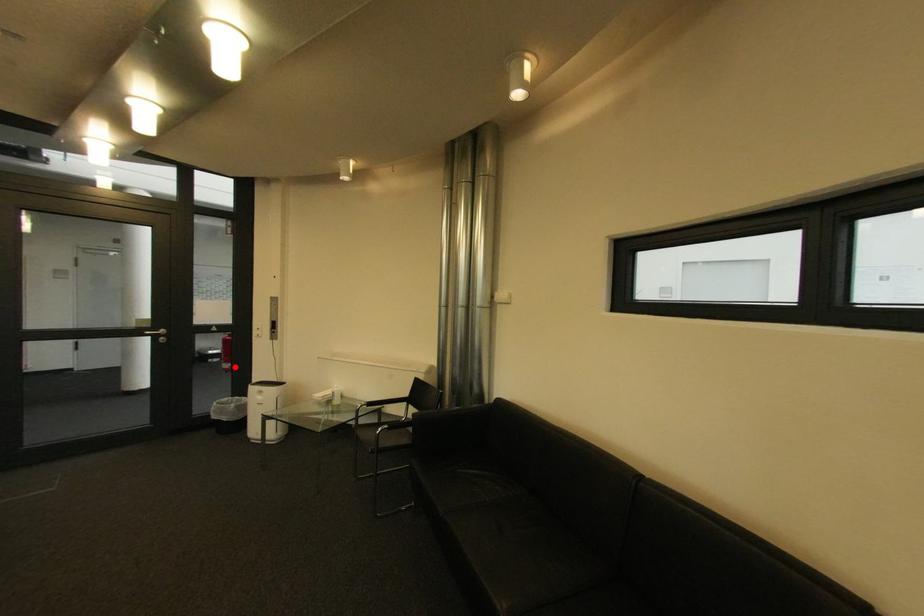
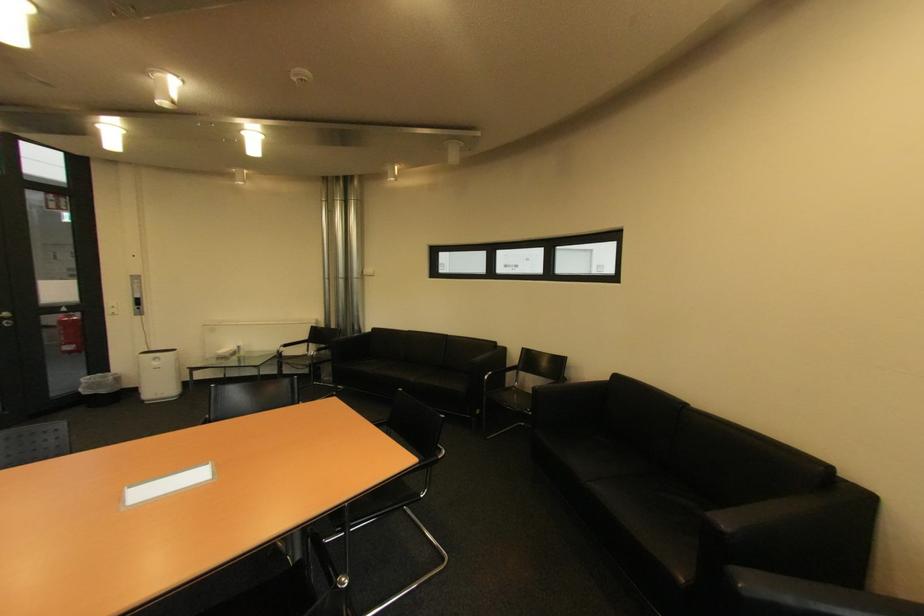
Question: I am providing you with two images of the same scene from different viewpoints. A red point is shown in image1. For the corresponding object point in image2, is it positioned nearer or farther from the camera?

Choices:
 (A) Nearer
 (B) Farther

Answer: (A)